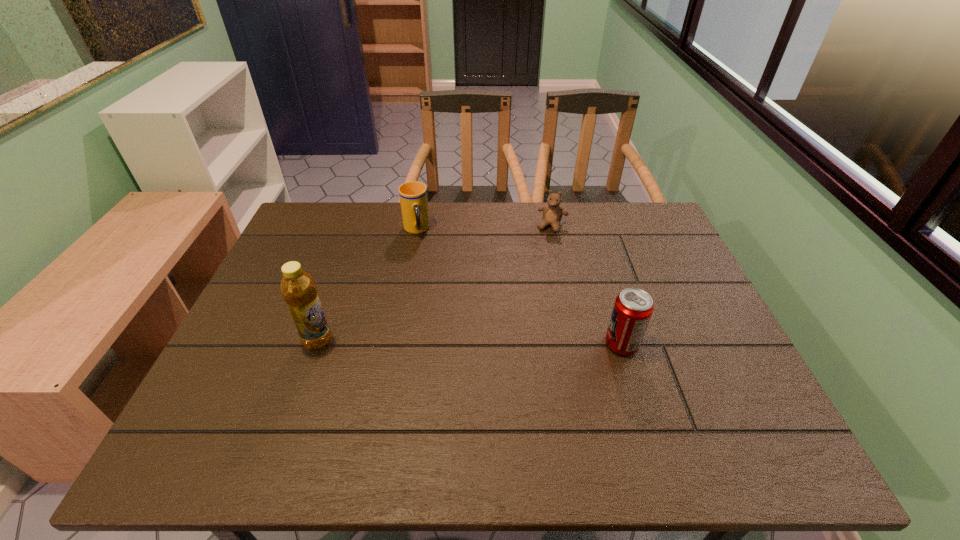
Identify the location of the leftmost object. The height and width of the screenshot is (540, 960). (298, 288).

Locate an element on the screen. the tallest object is located at coordinates (298, 288).

Image resolution: width=960 pixels, height=540 pixels. Find the location of `soda can`. soda can is located at coordinates (633, 307).

Find the location of a particular element. The image size is (960, 540). cup is located at coordinates tap(413, 195).

Locate an element on the screen. The height and width of the screenshot is (540, 960). the second object from right to left is located at coordinates (552, 213).

In order to click on teddy bear in this screenshot , I will do `click(552, 213)`.

This screenshot has width=960, height=540. Identify the location of free spot located on the back of the bottle. (334, 296).

Locate an element on the screen. This screenshot has height=540, width=960. free space located 0.200m on the left of the rightmost object is located at coordinates (521, 344).

At what (x,y) coordinates should I click in order to perform the action: click on blank space located on the side of the third object from right to left with the handle. Please return your answer as a coordinate pair (x, y). The height and width of the screenshot is (540, 960). Looking at the image, I should click on (429, 284).

This screenshot has width=960, height=540. I want to click on free spot located 0.220m on the side of the third object from right to left with the handle, so click(430, 288).